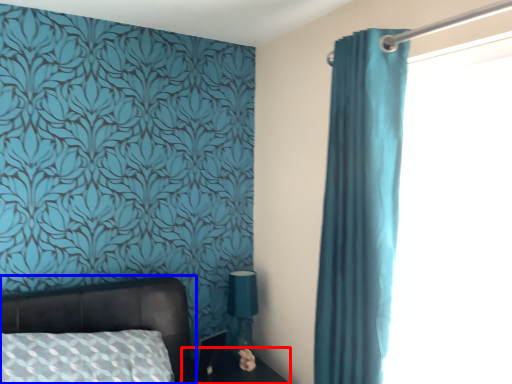
Question: Which of the following is the farthest to the observer, side table (highlighted by a red box) or bed (highlighted by a blue box)?

Choices:
 (A) side table
 (B) bed

Answer: (A)